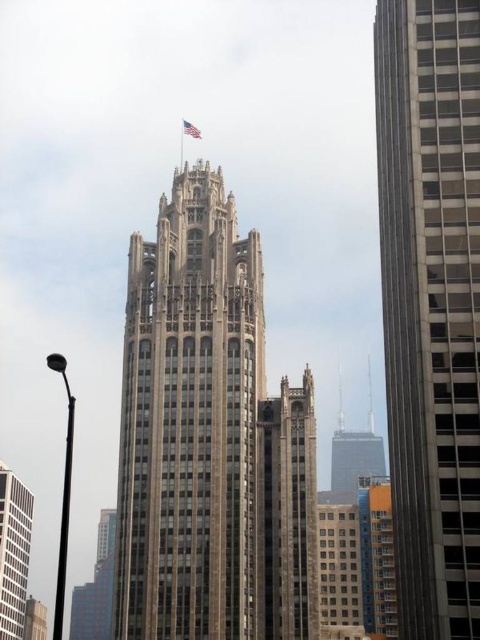
Question: Which of these objects is positioned closest to the white glass building at lower left?

Choices:
 (A) american flag at top
 (B) brown stone tower at center

Answer: (A)

Question: From the image, what is the correct spatial relationship of brown stone skyscraper at right in relation to white glass building at lower left?

Choices:
 (A) below
 (B) above

Answer: (B)

Question: Which object is the closest to the american flag at top?

Choices:
 (A) white glass building at lower left
 (B) brown stone tower at center

Answer: (B)

Question: Is brown stone skyscraper at right above american flag at top?

Choices:
 (A) no
 (B) yes

Answer: (A)

Question: Which point is closer to the camera taking this photo?

Choices:
 (A) (310, 385)
 (B) (10, 480)
 (C) (197, 136)

Answer: (A)

Question: Observing the image, what is the correct spatial positioning of brown stone tower at center in reference to american flag at top?

Choices:
 (A) right
 (B) left

Answer: (A)